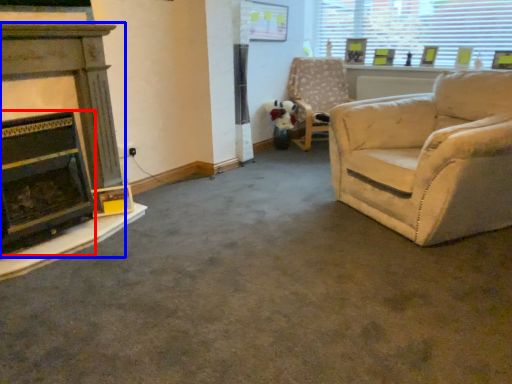
Question: Which object appears farthest to the camera in this image, fireplace (highlighted by a red box) or fireplace (highlighted by a blue box)?

Choices:
 (A) fireplace
 (B) fireplace

Answer: (B)